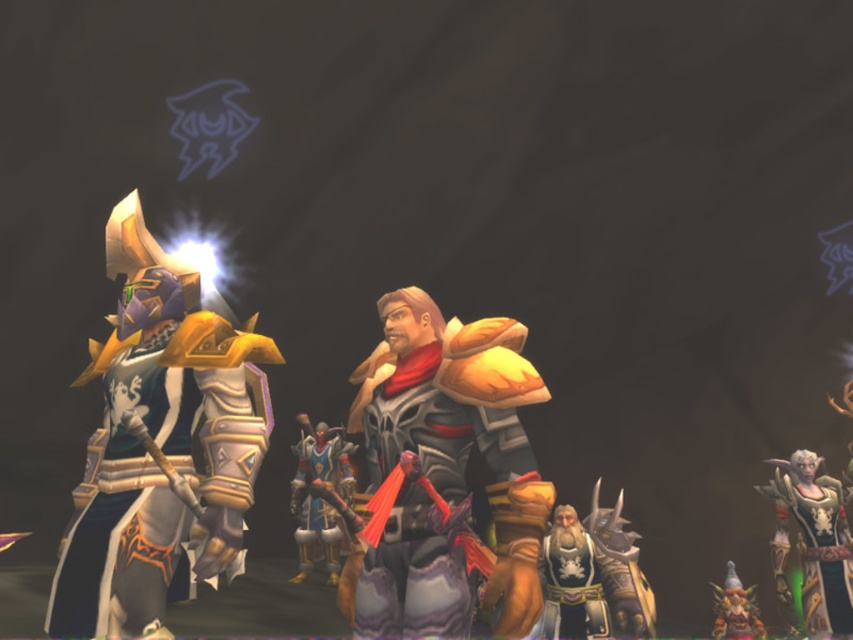
Image resolution: width=853 pixels, height=640 pixels. What do you see at coordinates (161, 445) in the screenshot?
I see `shiny gold armor at left` at bounding box center [161, 445].

In the scene shown: Does shiny gold armor at left have a smaller size compared to gold plated armor at left?

Actually, shiny gold armor at left might be larger than gold plated armor at left.

What do you see at coordinates (161, 445) in the screenshot?
I see `shiny gold armor at left` at bounding box center [161, 445].

Identify the location of shiny gold armor at left. Image resolution: width=853 pixels, height=640 pixels. (161, 445).